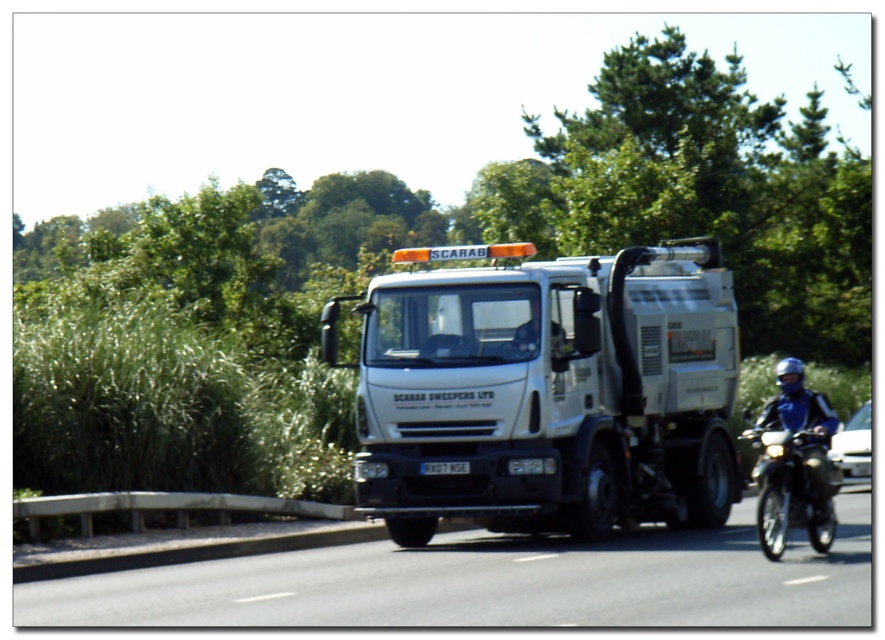
You are a delivery driver who needs to pass a motorcyclist wearing a blue leather jacket at right on a narrow black asphalt road at center. Can you safely pass the rider without going off the road?

The black asphalt road at center is wider than the blue leather jacket at right, so yes, you can safely pass the rider without going off the road since the road is wider than the motorcyclist.

You are a pedestrian standing at the point closest to the viewer between the two points labeled point (637, 248) and point (809, 452). Which point are you standing at?

You are standing at point (637, 248) because it is closer to the viewer than point (809, 452).